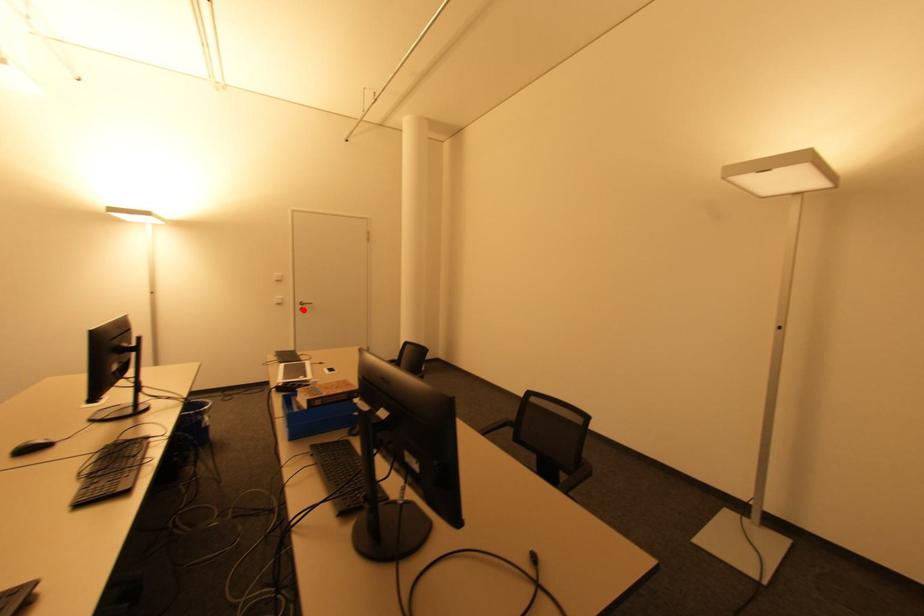
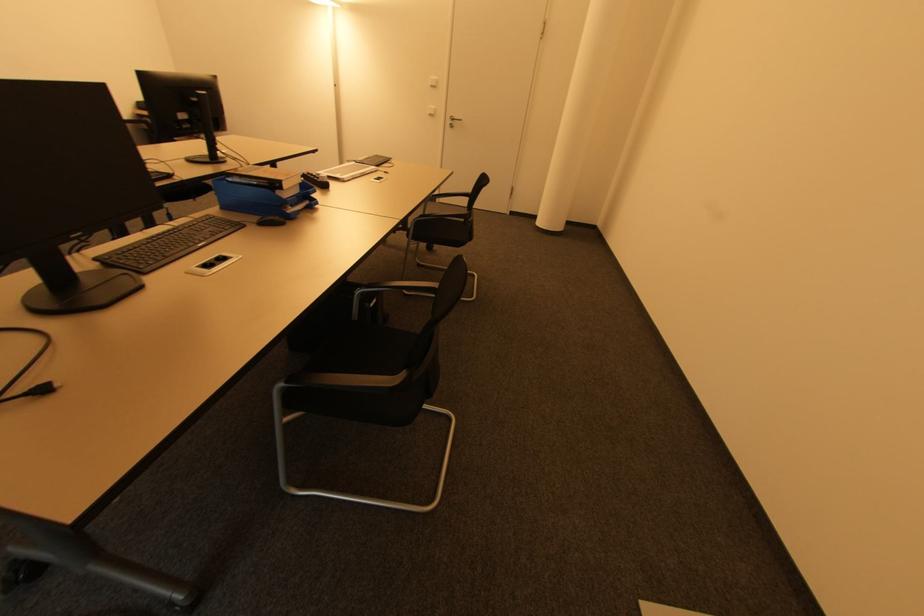
Question: I am providing you with two images of the same scene from different viewpoints. Image1 has a red point marked. In image2, the corresponding 3D location appears at what relative position? Reply with the corresponding letter.

Choices:
 (A) Closer
 (B) Farther

Answer: (A)